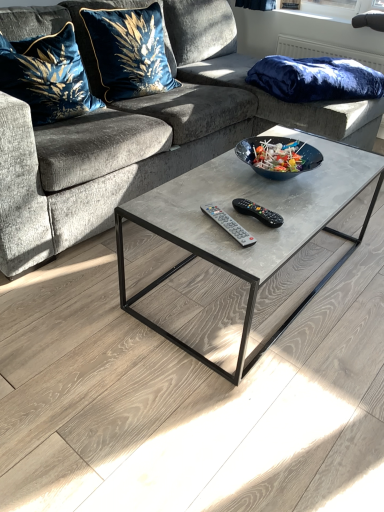
Question: Considering the relative positions of velvet fabric couch at center and velvet blue pillow at upper left, which appears as the second pillow when viewed from the left, in the image provided, is velvet fabric couch at center to the left or to the right of velvet blue pillow at upper left, which appears as the second pillow when viewed from the left,?

Choices:
 (A) left
 (B) right

Answer: (B)

Question: From the image's perspective, is velvet fabric couch at center located above or below velvet blue pillow at upper left, which appears as the second pillow when viewed from the left?

Choices:
 (A) below
 (B) above

Answer: (A)

Question: Which is farther from the velvet fabric couch at center?

Choices:
 (A) black plastic remote at center, the 2th remote in the left-to-right sequence
 (B) velvet blue pillow at upper left, which appears as the third pillow when viewed from the right
 (C) transparent plastic window screen at upper right
 (D) velvet blue pillow at upper left, which appears as the second pillow when viewed from the right
 (E) matte black remote at center, which is counted as the 2th remote, starting from the right

Answer: (C)

Question: Estimate the real-world distances between objects in this image. Which object is farther from the transparent plastic window screen at upper right?

Choices:
 (A) black plastic remote at center, marked as the 1th remote in a right-to-left arrangement
 (B) velvet blue pillow at upper left, which appears as the second pillow when viewed from the left
 (C) matte black remote at center, placed as the 1th remote when sorted from left to right
 (D) velvet fabric couch at center
 (E) velvet blue pillow at upper left, which appears as the third pillow when viewed from the right

Answer: (C)